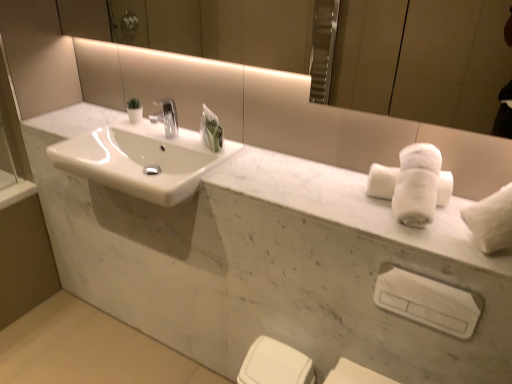
Question: Is white fluffy bath towel at right at the back of white marble sink at center?

Choices:
 (A) yes
 (B) no

Answer: (B)

Question: Is white fluffy bath towel at right completely or partially inside white marble sink at center?

Choices:
 (A) yes
 (B) no

Answer: (B)

Question: From a real-world perspective, is white marble sink at center positioned over white fluffy bath towel at right based on gravity?

Choices:
 (A) no
 (B) yes

Answer: (A)

Question: Is white marble sink at center closer to the viewer compared to white fluffy bath towel at right?

Choices:
 (A) no
 (B) yes

Answer: (A)

Question: Is white marble sink at center wider than white fluffy bath towel at right?

Choices:
 (A) no
 (B) yes

Answer: (B)

Question: From a real-world perspective, relative to white plastic towel bar at lower right, is white marble sink at center vertically above or below?

Choices:
 (A) below
 (B) above

Answer: (B)

Question: From the image's perspective, relative to white plastic towel bar at lower right, is white marble sink at center above or below?

Choices:
 (A) below
 (B) above

Answer: (B)

Question: Is white marble sink at center situated inside white plastic towel bar at lower right or outside?

Choices:
 (A) inside
 (B) outside

Answer: (B)

Question: Considering their positions, is white marble sink at center located in front of or behind white plastic towel bar at lower right?

Choices:
 (A) behind
 (B) front

Answer: (A)

Question: Considering their positions, is smooth concrete floor at lower left located in front of or behind white glossy porcelain at lower center, which is counted as the first porcelain, starting from the bottom?

Choices:
 (A) behind
 (B) front

Answer: (A)

Question: In terms of size, does smooth concrete floor at lower left appear bigger or smaller than white glossy porcelain at lower center, which is counted as the first porcelain, starting from the bottom?

Choices:
 (A) big
 (B) small

Answer: (A)

Question: Based on their positions, is smooth concrete floor at lower left located to the left or right of white glossy porcelain at lower center, marked as the second porcelain in a top-to-bottom arrangement?

Choices:
 (A) right
 (B) left

Answer: (B)

Question: Is smooth concrete floor at lower left inside or outside of white glossy porcelain at lower center, which is counted as the first porcelain, starting from the bottom?

Choices:
 (A) inside
 (B) outside

Answer: (B)

Question: Is white marble sink at center bigger or smaller than white glossy porcelain at lower center, marked as the second porcelain in a top-to-bottom arrangement?

Choices:
 (A) big
 (B) small

Answer: (A)

Question: Is point (126, 163) closer or farther from the camera than point (287, 354)?

Choices:
 (A) closer
 (B) farther

Answer: (B)